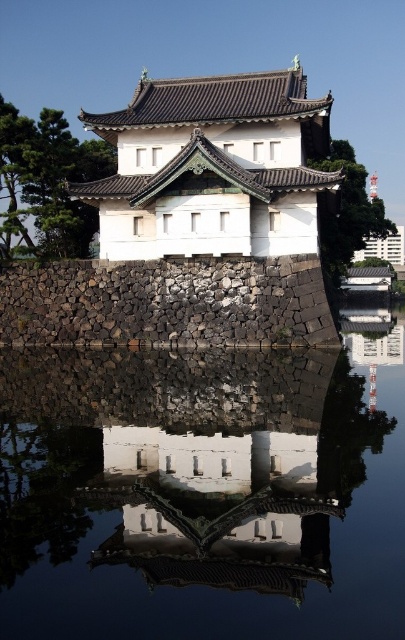
Can you confirm if transparent glass water at center is positioned to the right of black stone wall at center?

Yes, transparent glass water at center is to the right of black stone wall at center.

How distant is transparent glass water at center from black stone wall at center?

transparent glass water at center is 12.08 meters from black stone wall at center.

What do you see at coordinates (204, 492) in the screenshot? I see `transparent glass water at center` at bounding box center [204, 492].

I want to click on transparent glass water at center, so click(204, 492).

Who is taller, transparent glass water at center or white stone building at center?

white stone building at center

Who is shorter, transparent glass water at center or white stone building at center?

transparent glass water at center

The height and width of the screenshot is (640, 405). What do you see at coordinates (204, 492) in the screenshot?
I see `transparent glass water at center` at bounding box center [204, 492].

At what (x,y) coordinates should I click in order to perform the action: click on transparent glass water at center. Please return your answer as a coordinate pair (x, y). The width and height of the screenshot is (405, 640). Looking at the image, I should click on (204, 492).

This screenshot has width=405, height=640. What do you see at coordinates (211, 168) in the screenshot?
I see `white stone building at center` at bounding box center [211, 168].

Based on the photo, does white stone building at center have a lesser width compared to black stone wall at center?

No.

Measure the distance between white stone building at center and camera.

white stone building at center and camera are 238.34 feet apart from each other.

Image resolution: width=405 pixels, height=640 pixels. In order to click on white stone building at center in this screenshot , I will do `click(211, 168)`.